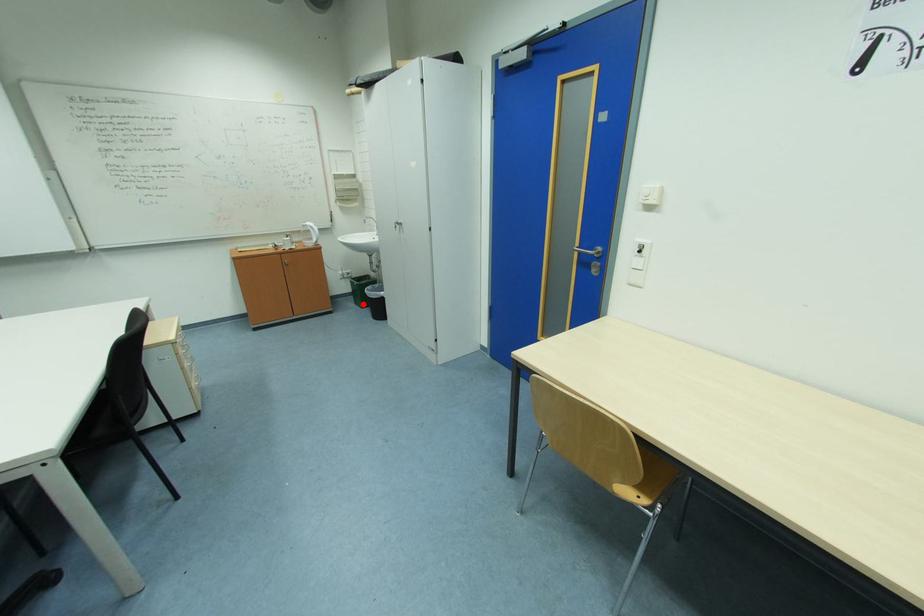
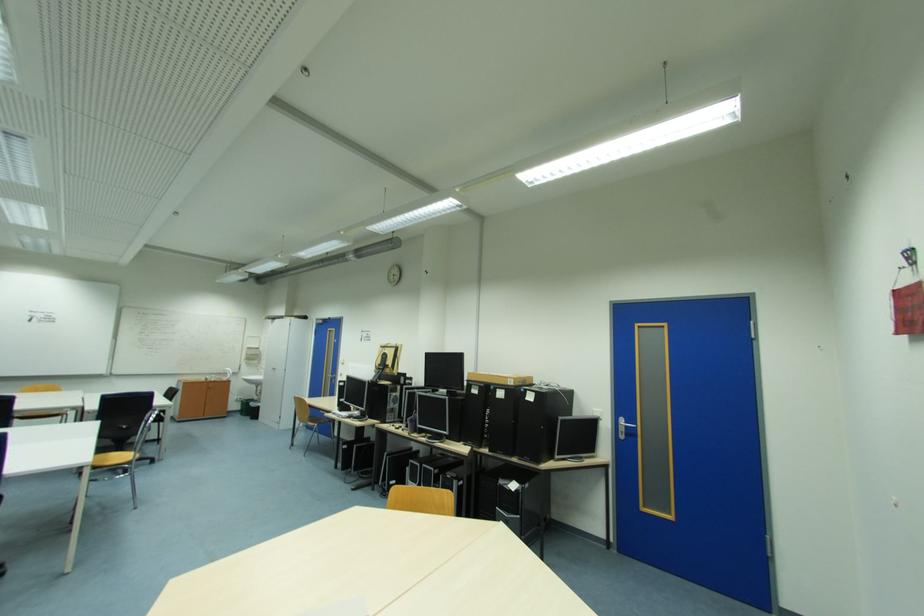
Question: I am providing you with two images of the same scene from different viewpoints. A red point is shown in image1. For the corresponding object point in image2, is it positioned nearer or farther from the camera?

Choices:
 (A) Nearer
 (B) Farther

Answer: (B)